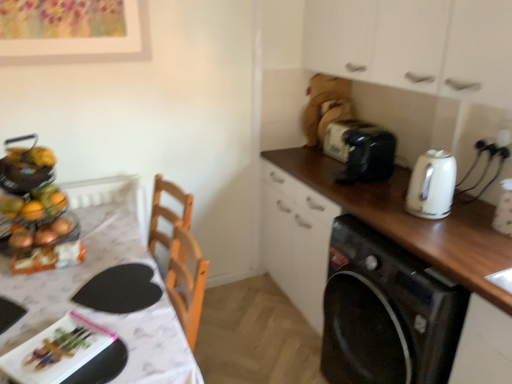
This screenshot has height=384, width=512. What do you see at coordinates (341, 137) in the screenshot?
I see `black plastic toaster at upper right` at bounding box center [341, 137].

The height and width of the screenshot is (384, 512). What do you see at coordinates (432, 185) in the screenshot?
I see `white glossy electric kettle at right` at bounding box center [432, 185].

What do you see at coordinates (386, 312) in the screenshot?
I see `black glossy washing machine at right` at bounding box center [386, 312].

Describe the element at coordinates (35, 204) in the screenshot. I see `metallic fruit basket at left` at that location.

In order to face metallic fruit basket at left, should I rotate leftwards or rightwards?

Rotate left and turn 27.499 degrees.

Where is `black plastic toaster at upper right`? This screenshot has height=384, width=512. black plastic toaster at upper right is located at coordinates [x=341, y=137].

Considering the positions of objects white glossy table at left and white glossy electric kettle at right in the image provided, who is in front, white glossy table at left or white glossy electric kettle at right?

white glossy table at left.

Which is behind, point (137, 372) or point (433, 213)?

The point (433, 213) is farther from the camera.

Identify the location of table below the white glossy electric kettle at right (from the image's perspective). (102, 312).

Which is more to the right, metallic fruit basket at left or white matte cabinet at upper right?

white matte cabinet at upper right.

Considering the relative sizes of metallic fruit basket at left and white matte cabinet at upper right in the image provided, is metallic fruit basket at left bigger than white matte cabinet at upper right?

No.

This screenshot has height=384, width=512. I want to click on food below the white matte cabinet at upper right (from a real-world perspective), so click(x=35, y=204).

From a real-world perspective, which object stands above the other?

In real-world perspective, black plastic toaster at upper right is above.

Is black plastic toaster at upper right surrounding white glossy table at left?

No, white glossy table at left is not a part of black plastic toaster at upper right.

How many degrees apart are the facing directions of black plastic toaster at upper right and white glossy table at left?

90 degrees.

Which of these two, black plastic toaster at upper right or white glossy table at left, is smaller?

black plastic toaster at upper right is smaller.

Can you tell me how much black glossy washing machine at right and black plastic toaster at upper right differ in facing direction?

0.99 degrees.

From the image's perspective, which one is positioned higher, black glossy washing machine at right or black plastic toaster at upper right?

black plastic toaster at upper right, from the image's perspective.

In the image, there is a black glossy washing machine at right. Identify the location of appliance above it (from the image's perspective). (341, 137).

Who is smaller, black glossy washing machine at right or black plastic toaster at upper right?

Smaller between the two is black plastic toaster at upper right.

Which is nearer, (362, 174) or (327, 127)?

Point (362, 174) is positioned closer to the camera compared to point (327, 127).

Considering the relative positions of black plastic toaster at upper right and black plastic toaster at upper right in the image provided, is black plastic toaster at upper right behind black plastic toaster at upper right?

No, it is in front of black plastic toaster at upper right.

Who is shorter, black plastic toaster at upper right or black plastic toaster at upper right?

Standing shorter between the two is black plastic toaster at upper right.

Is white glossy electric kettle at right facing towards metallic fruit basket at left?

No, white glossy electric kettle at right is not oriented towards metallic fruit basket at left.

From the image's perspective, between white glossy electric kettle at right and metallic fruit basket at left, who is located below?

From the image's view, metallic fruit basket at left is below.

From a real-world perspective, is white glossy electric kettle at right physically below metallic fruit basket at left?

No, from a real-world perspective, white glossy electric kettle at right is not under metallic fruit basket at left.

Would you say white matte cabinet at upper right contains white glossy electric kettle at right?

→ Definitely not — white glossy electric kettle at right is not inside white matte cabinet at upper right.

Locate an element on the screen. kitchen appliance located underneath the white matte cabinet at upper right (from a real-world perspective) is located at coordinates (432, 185).

Could you tell me if white matte cabinet at upper right is turned towards white glossy electric kettle at right?

No, white matte cabinet at upper right is not aimed at white glossy electric kettle at right.

Would you consider white matte cabinet at upper right to be distant from white glossy electric kettle at right?

That's not correct — white matte cabinet at upper right is a little close to white glossy electric kettle at right.

Identify the location of kitchen appliance behind the white glossy table at left. (432, 185).

Where is `food located underneath the white matte cabinet at upper right (from a real-world perspective)`? The height and width of the screenshot is (384, 512). food located underneath the white matte cabinet at upper right (from a real-world perspective) is located at coordinates (35, 204).

Looking at this image, considering their positions, is black plastic toaster at upper right positioned closer to white glossy table at left than black glossy washing machine at right?

Among the two, black glossy washing machine at right is located nearer to white glossy table at left.

Based on their spatial positions, is white matte cabinet at upper right or white glossy table at left closer to black plastic toaster at upper right?

white matte cabinet at upper right is positioned closer to the anchor black plastic toaster at upper right.

When comparing their distances from black plastic toaster at upper right, does white glossy electric kettle at right or white glossy table at left seem closer?

The object closer to black plastic toaster at upper right is white glossy electric kettle at right.

Looking at the image, which one is located further to white glossy electric kettle at right, metallic fruit basket at left or white glossy table at left?

Based on the image, metallic fruit basket at left appears to be further to white glossy electric kettle at right.

Based on their spatial positions, is white glossy table at left or black plastic toaster at upper right further from metallic fruit basket at left?

black plastic toaster at upper right.

From the picture: When comparing their distances from white glossy electric kettle at right, does black plastic toaster at upper right or metallic fruit basket at left seem closer?

Among the two, black plastic toaster at upper right is located nearer to white glossy electric kettle at right.

Based on their spatial positions, is white glossy electric kettle at right or white glossy table at left further from white matte cabinet at upper right?

white glossy table at left is positioned further to the anchor white matte cabinet at upper right.

Based on their spatial positions, is black plastic toaster at upper right or white matte cabinet at upper right closer to white glossy electric kettle at right?

Based on the image, white matte cabinet at upper right appears to be nearer to white glossy electric kettle at right.

Image resolution: width=512 pixels, height=384 pixels. I want to click on toaster between metallic fruit basket at left and black glossy washing machine at right in the horizontal direction, so (360, 151).

At what (x,y) coordinates should I click in order to perform the action: click on table between metallic fruit basket at left and black plastic toaster at upper right from left to right. Please return your answer as a coordinate pair (x, y). The image size is (512, 384). Looking at the image, I should click on pos(102,312).

This screenshot has width=512, height=384. I want to click on toaster between white glossy electric kettle at right and black plastic toaster at upper right from front to back, so click(360, 151).

Image resolution: width=512 pixels, height=384 pixels. What are the coordinates of `toaster located between black glossy washing machine at right and black plastic toaster at upper right in the depth direction` in the screenshot? It's located at (360, 151).